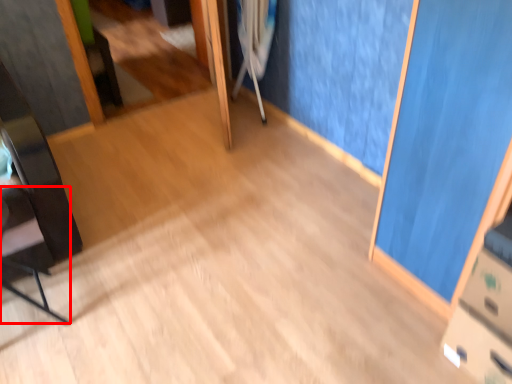
Question: Observing the image, what is the correct spatial positioning of chair (annotated by the red box) in reference to crutch?

Choices:
 (A) left
 (B) right

Answer: (A)